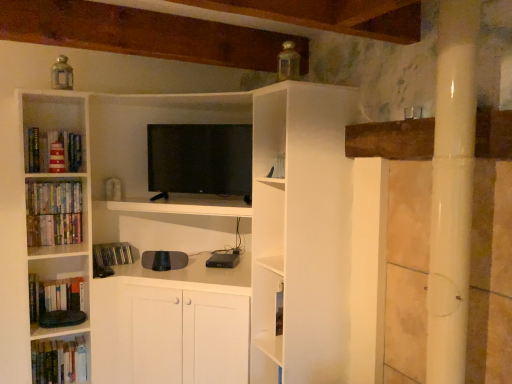
Question: Is hardcover books at lower left, which is the 2th book from bottom to top, located within hardcover books at left, the first book ordered from the bottom?

Choices:
 (A) no
 (B) yes

Answer: (A)

Question: Is hardcover books at left, the first book ordered from the bottom, not within hardcover books at lower left, which ranks as the 5th book in top-to-bottom order?

Choices:
 (A) no
 (B) yes

Answer: (B)

Question: Is hardcover books at left, the first book ordered from the bottom, at the left side of hardcover books at lower left, which ranks as the 5th book in top-to-bottom order?

Choices:
 (A) no
 (B) yes

Answer: (B)

Question: From the image's perspective, does hardcover books at left, the first book ordered from the bottom, appear higher than hardcover books at lower left, which is the 2th book from bottom to top?

Choices:
 (A) yes
 (B) no

Answer: (B)

Question: Is hardcover books at left, the first book ordered from the bottom, oriented towards hardcover books at lower left, which ranks as the 5th book in top-to-bottom order?

Choices:
 (A) no
 (B) yes

Answer: (A)

Question: From a real-world perspective, is hardcover books at left, the 6th book positioned from the top, located beneath hardcover books at lower left, which ranks as the 5th book in top-to-bottom order?

Choices:
 (A) yes
 (B) no

Answer: (A)

Question: Considering the relative sizes of hardcover books at lower left, which ranks as the 5th book in top-to-bottom order, and matte black cd case at lower left, the 4th book viewed from the top, in the image provided, is hardcover books at lower left, which ranks as the 5th book in top-to-bottom order, thinner than matte black cd case at lower left, the 4th book viewed from the top,?

Choices:
 (A) yes
 (B) no

Answer: (B)

Question: Is hardcover books at lower left, which ranks as the 5th book in top-to-bottom order, looking in the opposite direction of matte black cd case at lower left, the third book in the bottom-to-top sequence?

Choices:
 (A) no
 (B) yes

Answer: (A)

Question: Can you confirm if hardcover books at lower left, which is the 2th book from bottom to top, is smaller than matte black cd case at lower left, the 4th book viewed from the top?

Choices:
 (A) no
 (B) yes

Answer: (A)

Question: Can you confirm if hardcover books at lower left, which is the 2th book from bottom to top, is positioned to the right of matte black cd case at lower left, the 4th book viewed from the top?

Choices:
 (A) no
 (B) yes

Answer: (A)

Question: Is hardcover books at lower left, which ranks as the 5th book in top-to-bottom order, outside of matte black cd case at lower left, the third book in the bottom-to-top sequence?

Choices:
 (A) no
 (B) yes

Answer: (B)

Question: Can you confirm if hardcover books at lower left, which is the 2th book from bottom to top, is wider than matte black cd case at lower left, the third book in the bottom-to-top sequence?

Choices:
 (A) yes
 (B) no

Answer: (A)

Question: Is hardcover books at left, the fourth book ordered from the bottom, looking in the opposite direction of hardcover books at left, the first book ordered from the bottom?

Choices:
 (A) no
 (B) yes

Answer: (A)